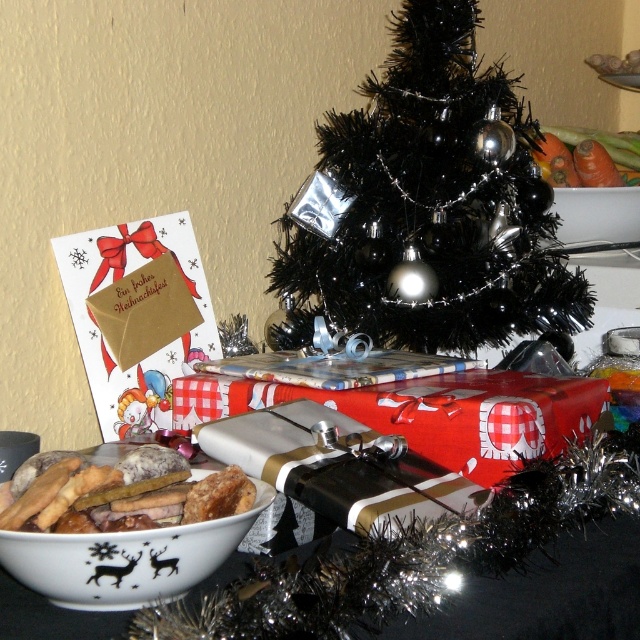
Consider the image. Is black shiny christmas tree at center smaller than golden crumbly cookies at lower left?

No.

Is black shiny christmas tree at center to the right of golden crumbly cookies at lower left from the viewer's perspective?

Correct, you'll find black shiny christmas tree at center to the right of golden crumbly cookies at lower left.

Which is in front, point (486, 118) or point (150, 470)?

Point (150, 470) is more forward.

In order to click on black shiny christmas tree at center in this screenshot , I will do `click(433, 205)`.

Is point (422, 321) positioned before point (157, 544)?

No, (422, 321) is behind (157, 544).

From the picture: Who is more distant from viewer, (496, 141) or (148, 598)?

Positioned behind is point (496, 141).

At what (x,y) coordinates should I click in order to perform the action: click on black shiny christmas tree at center. Please return your answer as a coordinate pair (x, y). The width and height of the screenshot is (640, 640). Looking at the image, I should click on (433, 205).

Between white ceramic bowl at lower left and white glossy bowl at upper center, which one is positioned lower?

white ceramic bowl at lower left

Can you confirm if white ceramic bowl at lower left is thinner than white glossy bowl at upper center?

In fact, white ceramic bowl at lower left might be wider than white glossy bowl at upper center.

Which is behind, point (33, 541) or point (621, 241)?

The point (621, 241) is behind.

This screenshot has height=640, width=640. Find the location of `white ceramic bowl at lower left`. white ceramic bowl at lower left is located at coordinates (124, 560).